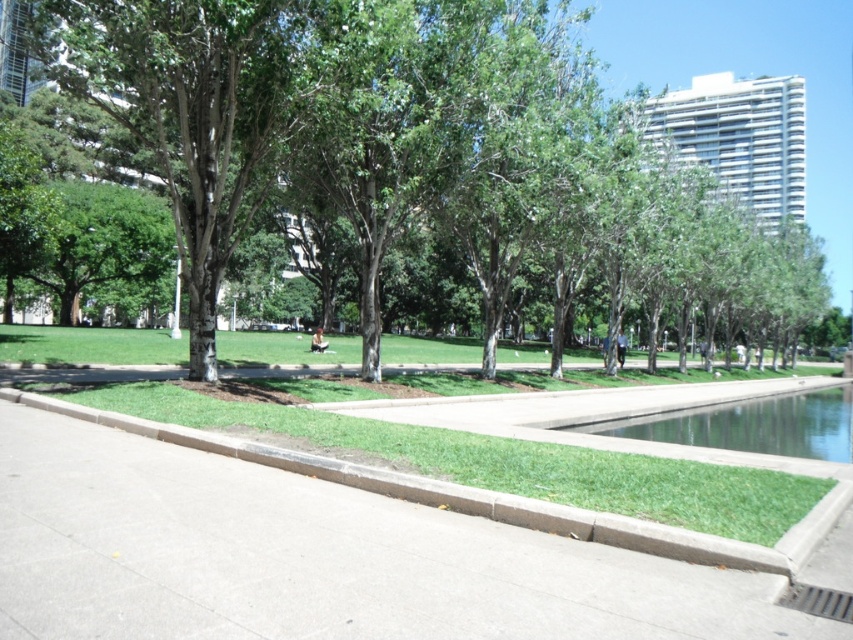
Which is more to the right, green leafy tree at center or concrete at center?

green leafy tree at center

Can you confirm if green leafy tree at center is taller than concrete at center?

Correct, green leafy tree at center is much taller as concrete at center.

Does point (131, 84) lie behind point (16, 493)?

Yes.

Where is `green leafy tree at center`? The image size is (853, 640). green leafy tree at center is located at coordinates coord(409,147).

Between concrete at center and clear glass water at center, which one has more height?

clear glass water at center

Describe the element at coordinates (315, 557) in the screenshot. I see `concrete at center` at that location.

I want to click on concrete at center, so click(x=315, y=557).

Does green leafy tree at center have a larger size compared to clear glass water at center?

Yes, green leafy tree at center is bigger than clear glass water at center.

Which is more to the left, green leafy tree at center or clear glass water at center?

clear glass water at center

Is point (468, 236) closer to camera compared to point (679, 432)?

No, (468, 236) is behind (679, 432).

Find the location of `green leafy tree at center`. green leafy tree at center is located at coordinates pyautogui.click(x=409, y=147).